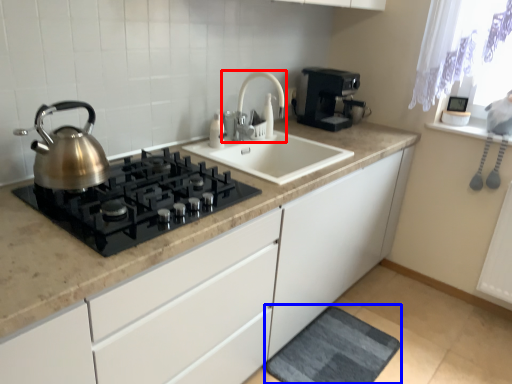
Question: Which object is further to the camera taking this photo, tap (highlighted by a red box) or bath mat (highlighted by a blue box)?

Choices:
 (A) tap
 (B) bath mat

Answer: (A)